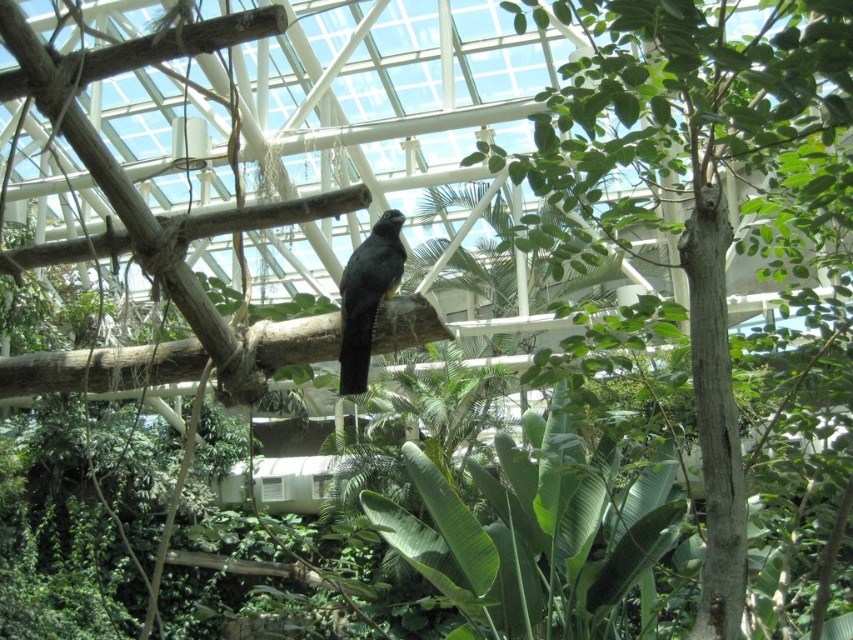
Question: Does green rough bark tree at center have a lesser width compared to black glossy bird at center?

Choices:
 (A) yes
 (B) no

Answer: (B)

Question: Can you confirm if green rough bark tree at center is wider than black glossy bird at center?

Choices:
 (A) yes
 (B) no

Answer: (A)

Question: Does green rough bark tree at center appear under black glossy bird at center?

Choices:
 (A) no
 (B) yes

Answer: (A)